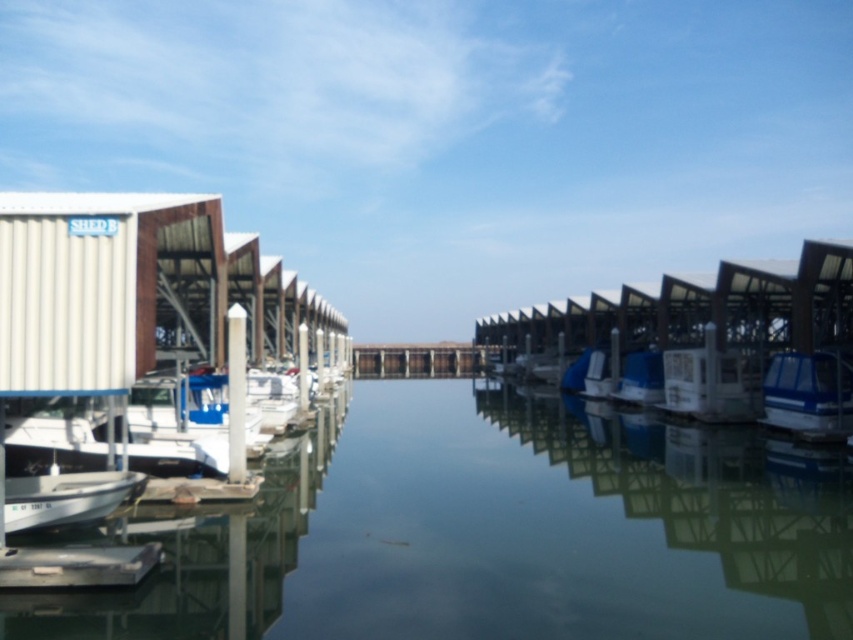
Question: In this image, where is white matte boat at lower left located relative to brown wooden dock at center?

Choices:
 (A) above
 (B) below

Answer: (A)

Question: Can you confirm if blue glossy boat at center is wider than white glossy boat at center?

Choices:
 (A) no
 (B) yes

Answer: (B)

Question: Is blue glossy boat at center positioned before white glossy boat at center?

Choices:
 (A) yes
 (B) no

Answer: (A)

Question: Which object is the farthest from the white matte boat at lower left?

Choices:
 (A) blue glossy boat at center
 (B) white glossy boat at center
 (C) brown wooden dock at center
 (D) clear glass water at center

Answer: (C)

Question: Which object is closer to the camera taking this photo?

Choices:
 (A) white matte boat at lower left
 (B) clear glass water at center

Answer: (B)

Question: Which of the following is the closest to the observer?

Choices:
 (A) (99, 497)
 (B) (778, 448)
 (C) (793, 403)
 (D) (642, 403)

Answer: (A)